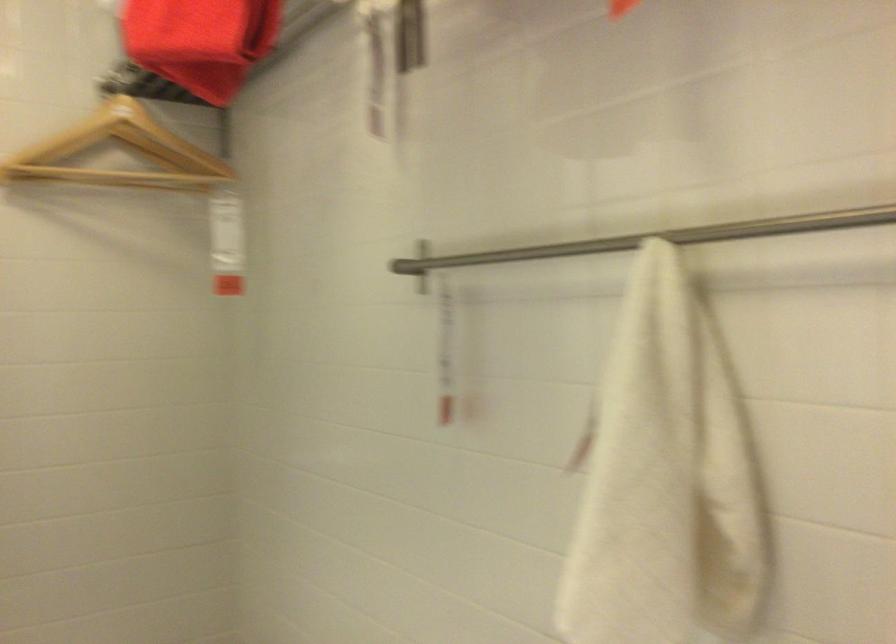
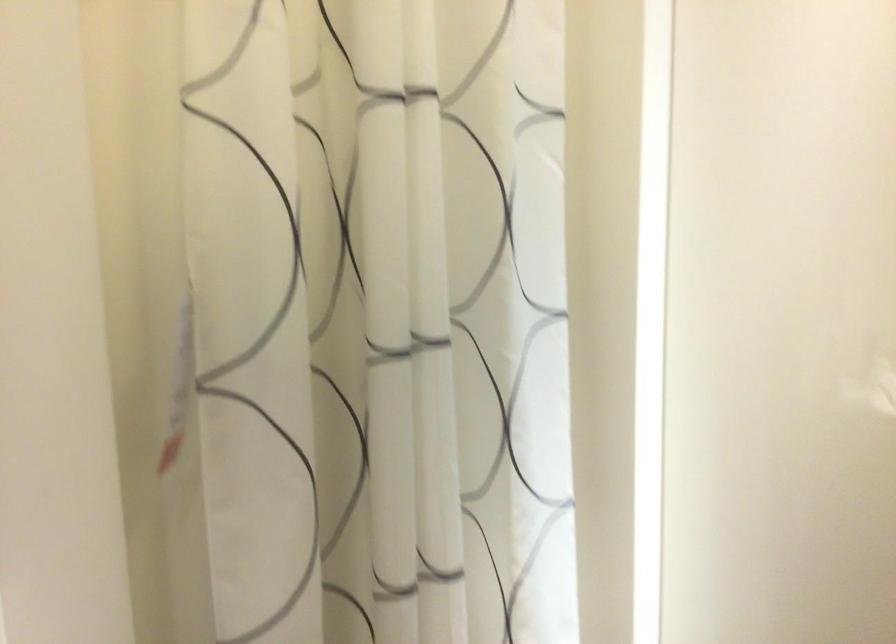
Question: How did the camera likely rotate?

Choices:
 (A) Left
 (B) Right
 (C) Up
 (D) Down

Answer: (A)